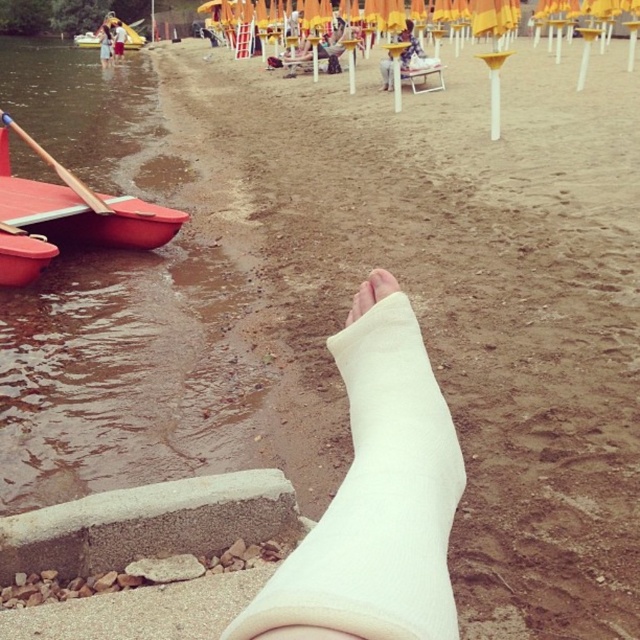
Question: Does beige sandy beach at center have a lesser width compared to red plastic boat at upper left?

Choices:
 (A) no
 (B) yes

Answer: (A)

Question: Estimate the real-world distances between objects in this image. Which object is farther from the white cast leg at lower center?

Choices:
 (A) white soft cast at center
 (B) red plastic boat at upper left

Answer: (A)

Question: Is beige sandy beach at center above white cast at lower center?

Choices:
 (A) yes
 (B) no

Answer: (B)

Question: Does red plastic boat at upper left appear on the right side of white cast leg at lower center?

Choices:
 (A) no
 (B) yes

Answer: (A)

Question: Which object is closer to the camera taking this photo?

Choices:
 (A) white cast leg at lower center
 (B) white soft cast at center

Answer: (B)

Question: Which point is farther to the camera?

Choices:
 (A) white fabric cast at center
 (B) wooden paddle at left
 (C) white soft cast at center
 (D) red plastic boat at upper left

Answer: (D)